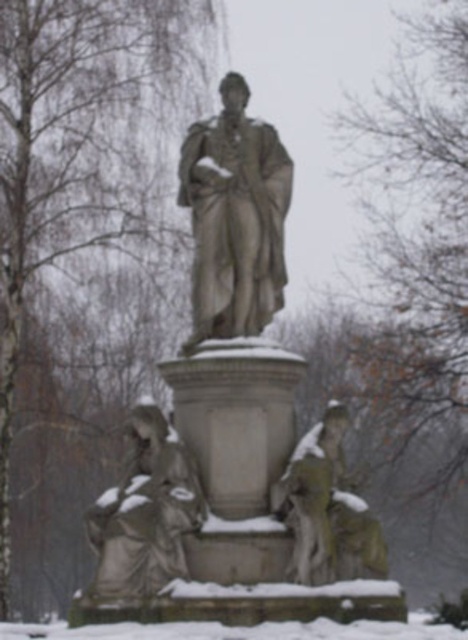
Looking at this image, can you confirm if gray stone statue at center is positioned below white powdery snow at lower center?

Incorrect, gray stone statue at center is not positioned below white powdery snow at lower center.

Can you confirm if gray stone statue at center is wider than white powdery snow at lower center?

In fact, gray stone statue at center might be narrower than white powdery snow at lower center.

Who is more distant from viewer, (241, 225) or (226, 625)?

Point (241, 225)

What are the coordinates of `gray stone statue at center` in the screenshot? It's located at (234, 218).

Is bare branches at upper center thinner than green mossy statue at lower right?

No.

Is bare branches at upper center closer to the viewer compared to green mossy statue at lower right?

No, it is behind green mossy statue at lower right.

Does point (438, 483) come closer to viewer compared to point (351, 566)?

No.

This screenshot has width=468, height=640. In order to click on bare branches at upper center in this screenshot , I will do `click(418, 244)`.

Is point (190, 460) closer to camera compared to point (411, 618)?

Yes.

Which is below, gray stone figure at lower left or white powdery snow at lower center?

white powdery snow at lower center

Find the location of a particular element. The width and height of the screenshot is (468, 640). gray stone figure at lower left is located at coordinates (145, 512).